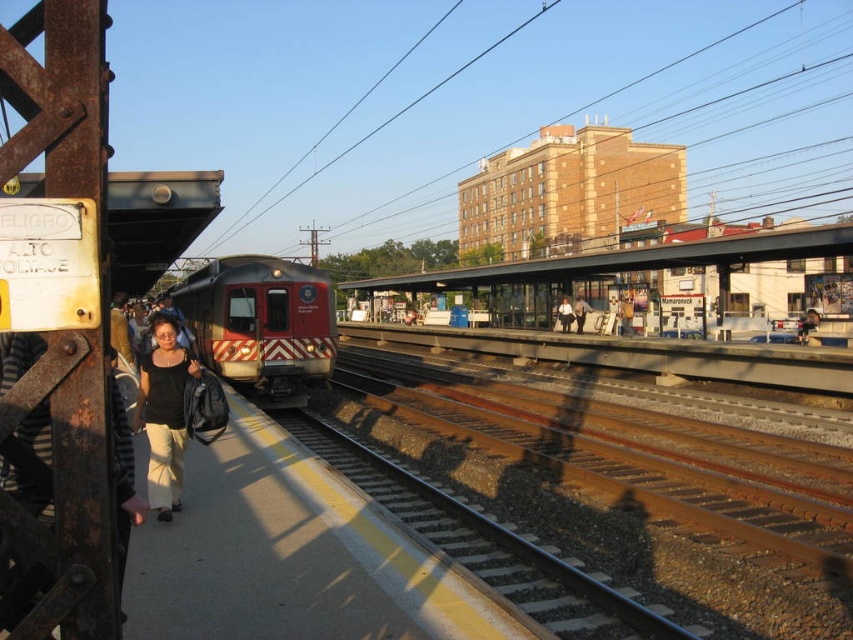
Question: Which object is the farthest from the black cotton shirt at center?

Choices:
 (A) matte black jacket at center
 (B) smooth black shirt at center
 (C) red glossy train at center
 (D) rusty metal track at center

Answer: (A)

Question: Can you confirm if black cotton shirt at center is positioned below matte black jacket at center?

Choices:
 (A) no
 (B) yes

Answer: (B)

Question: Is rusty metal track at center smaller than matte black jacket at center?

Choices:
 (A) no
 (B) yes

Answer: (A)

Question: Which object appears farthest from the camera in this image?

Choices:
 (A) black cotton shirt at center
 (B) rusty metal track at center
 (C) red glossy train at center
 (D) dark blue jeans at center

Answer: (D)

Question: Is smooth black shirt at center to the left of dark blue jeans at center from the viewer's perspective?

Choices:
 (A) yes
 (B) no

Answer: (B)

Question: Estimate the real-world distances between objects in this image. Which object is closer to the smooth black shirt at center?

Choices:
 (A) black cotton shirt at center
 (B) red glossy train at center
 (C) rusty metal track at center

Answer: (C)